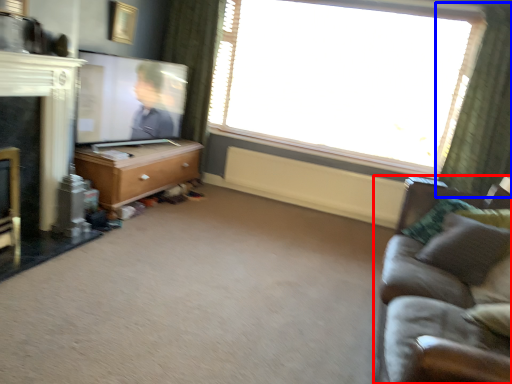
Question: Which point is further to the camera, studio couch (highlighted by a red box) or curtain (highlighted by a blue box)?

Choices:
 (A) studio couch
 (B) curtain

Answer: (B)